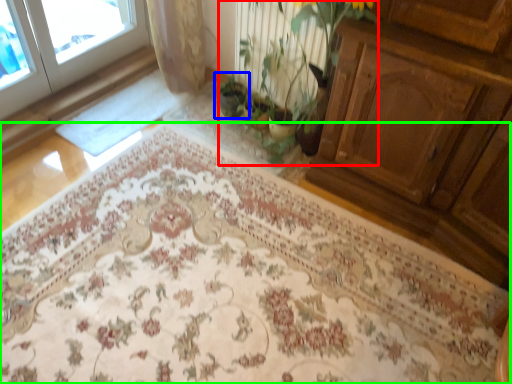
Question: Which object is positioned farthest from floral arrangement (highlighted by a red box)? Select from houseplant (highlighted by a blue box) and mat (highlighted by a green box).

Choices:
 (A) houseplant
 (B) mat

Answer: (B)